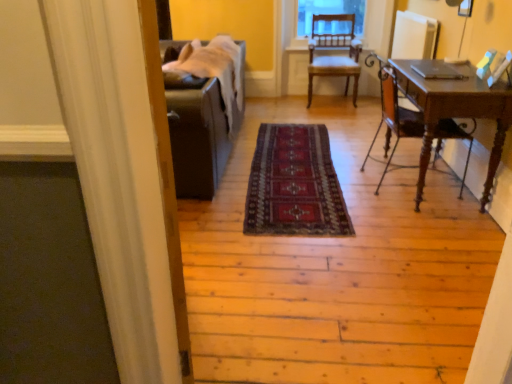
Question: Should I look upward or downward to see wooden chair at center, placed as the 1th chair when sorted from top to bottom?

Choices:
 (A) up
 (B) down

Answer: (A)

Question: Considering the relative sizes of dark red woven rug at center and mahogany wood desk at right, the first chair positioned from the front, in the image provided, is dark red woven rug at center shorter than mahogany wood desk at right, the first chair positioned from the front,?

Choices:
 (A) yes
 (B) no

Answer: (A)

Question: Can mahogany wood desk at right, acting as the second chair starting from the back, be found inside dark red woven rug at center?

Choices:
 (A) no
 (B) yes

Answer: (A)

Question: From a real-world perspective, is dark red woven rug at center over mahogany wood desk at right, acting as the second chair starting from the back?

Choices:
 (A) yes
 (B) no

Answer: (B)

Question: Can you confirm if dark red woven rug at center is taller than mahogany wood desk at right, acting as the second chair starting from the back?

Choices:
 (A) yes
 (B) no

Answer: (B)

Question: From a real-world perspective, is dark red woven rug at center below mahogany wood desk at right, which is the 2th chair in top-to-bottom order?

Choices:
 (A) yes
 (B) no

Answer: (A)

Question: Can you confirm if dark red woven rug at center is thinner than mahogany wood desk at right, acting as the second chair starting from the back?

Choices:
 (A) yes
 (B) no

Answer: (B)

Question: From the image's perspective, is wooden chair at center, arranged as the first chair when viewed from the back, above dark red woven rug at center?

Choices:
 (A) no
 (B) yes

Answer: (B)

Question: Would you say dark red woven rug at center is part of wooden chair at center, which is the 2th chair in front-to-back order,'s contents?

Choices:
 (A) yes
 (B) no

Answer: (B)

Question: Is wooden chair at center, which is the 2th chair in front-to-back order, positioned behind dark red woven rug at center?

Choices:
 (A) yes
 (B) no

Answer: (A)

Question: Does wooden chair at center, placed as the 1th chair when sorted from top to bottom, touch dark red woven rug at center?

Choices:
 (A) no
 (B) yes

Answer: (A)

Question: Would you say wooden chair at center, which appears as the 2th chair when ordered from the bottom, is outside dark red woven rug at center?

Choices:
 (A) no
 (B) yes

Answer: (B)

Question: Does wooden chair at center, which is the 2th chair in front-to-back order, turn towards dark red woven rug at center?

Choices:
 (A) yes
 (B) no

Answer: (A)

Question: Does mahogany wood desk at right, the first chair positioned from the front, have a lesser height compared to wooden chair at center, which appears as the 2th chair when ordered from the bottom?

Choices:
 (A) no
 (B) yes

Answer: (B)